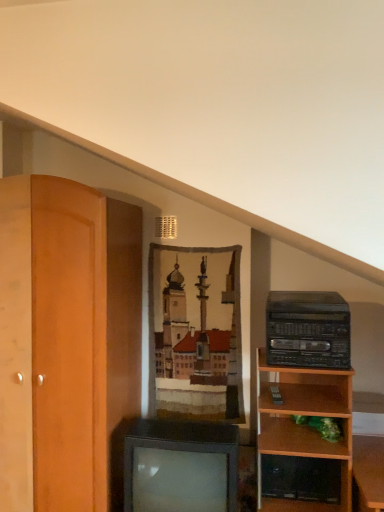
Question: Should I look upward or downward to see black plastic stereo at right?

Choices:
 (A) up
 (B) down

Answer: (B)

Question: Could you tell me if metallic gray television at center is facing black plastic stereo at right?

Choices:
 (A) no
 (B) yes

Answer: (A)

Question: Can you confirm if metallic gray television at center is shorter than black plastic stereo at right?

Choices:
 (A) no
 (B) yes

Answer: (A)

Question: Is metallic gray television at center to the right of black plastic stereo at right from the viewer's perspective?

Choices:
 (A) no
 (B) yes

Answer: (A)

Question: Considering the relative sizes of metallic gray television at center and black plastic stereo at right in the image provided, is metallic gray television at center bigger than black plastic stereo at right?

Choices:
 (A) no
 (B) yes

Answer: (B)

Question: Considering the relative sizes of metallic gray television at center and black plastic stereo at right in the image provided, is metallic gray television at center wider than black plastic stereo at right?

Choices:
 (A) yes
 (B) no

Answer: (A)

Question: Can you confirm if metallic gray television at center is positioned to the left of black plastic stereo at right?

Choices:
 (A) yes
 (B) no

Answer: (A)

Question: Considering the relative sizes of black plastic stereo at right and metallic gray television at center in the image provided, is black plastic stereo at right shorter than metallic gray television at center?

Choices:
 (A) no
 (B) yes

Answer: (B)

Question: Can you confirm if black plastic stereo at right is smaller than metallic gray television at center?

Choices:
 (A) no
 (B) yes

Answer: (B)

Question: Is black plastic stereo at right bigger than metallic gray television at center?

Choices:
 (A) no
 (B) yes

Answer: (A)

Question: From the image's perspective, is black plastic stereo at right below metallic gray television at center?

Choices:
 (A) no
 (B) yes

Answer: (A)

Question: From a real-world perspective, is black plastic stereo at right under metallic gray television at center?

Choices:
 (A) yes
 (B) no

Answer: (B)

Question: Is metallic gray television at center located within black plastic stereo at right?

Choices:
 (A) yes
 (B) no

Answer: (B)

Question: Considering the positions of metallic gray television at center and black plastic stereo at right in the image, is metallic gray television at center taller or shorter than black plastic stereo at right?

Choices:
 (A) tall
 (B) short

Answer: (A)